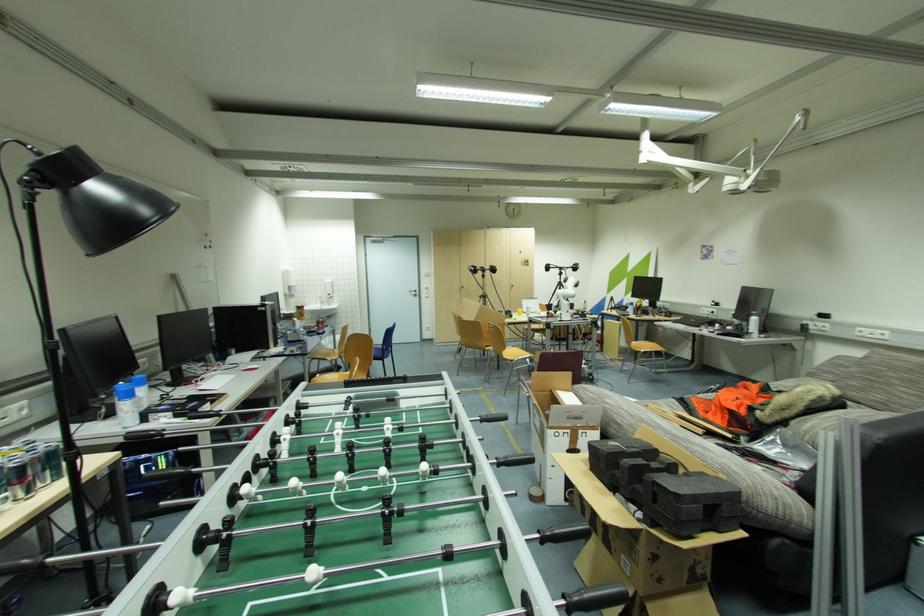
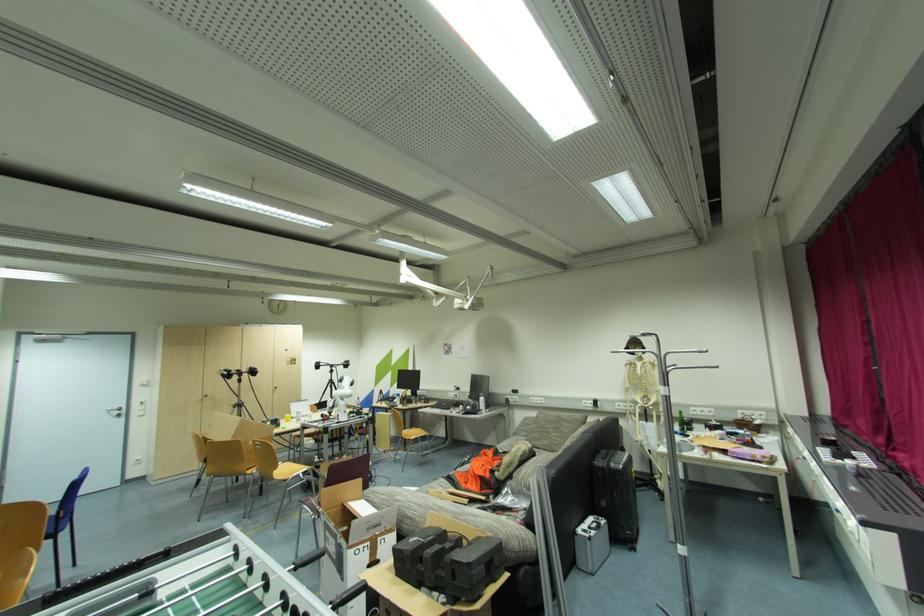
Where in the second image is the point corresponding to (x=418, y=294) from the first image?

(122, 413)